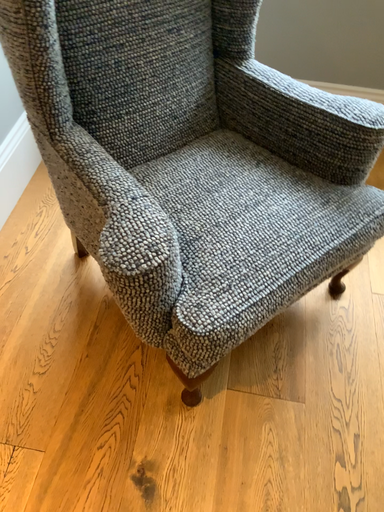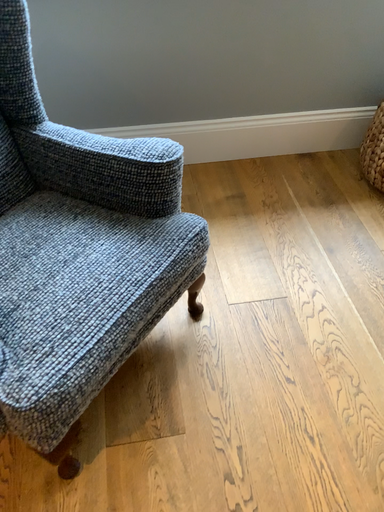
Question: Which way did the camera rotate in the video?

Choices:
 (A) rotated downward
 (B) rotated upward

Answer: (B)